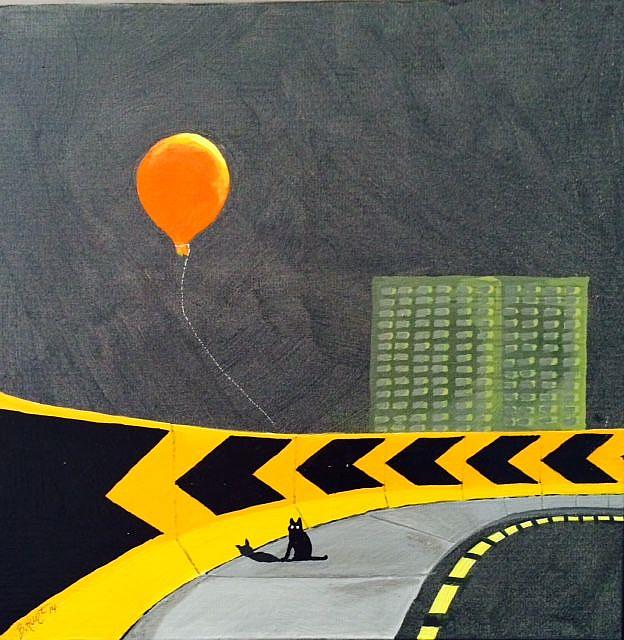
Locate an element on the screen. The image size is (624, 640). painting is located at coordinates (461, 171).